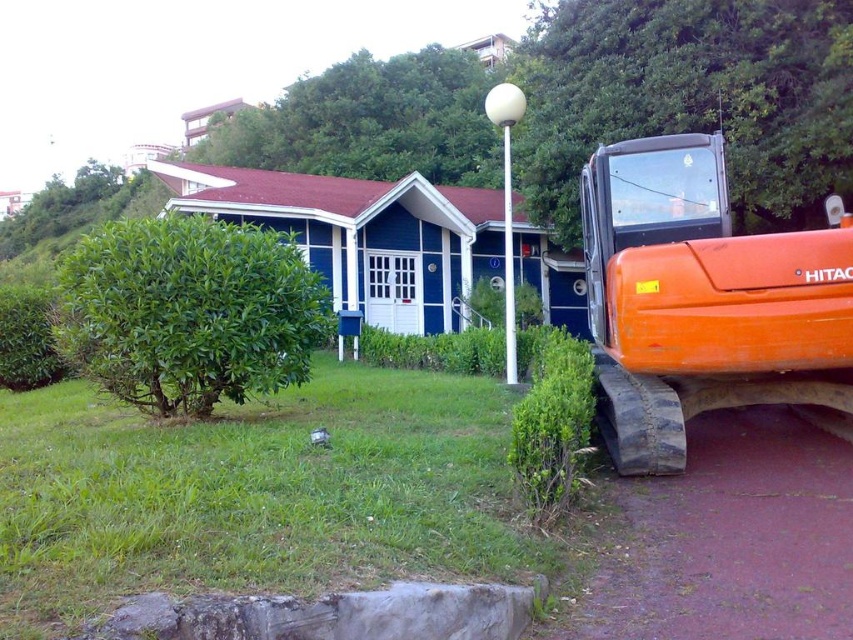
Does green grass at lower left appear under orange rubber tractor at right?

Indeed, green grass at lower left is positioned under orange rubber tractor at right.

Which is behind, point (32, 444) or point (677, 321)?

The point (677, 321) is more distant.

Find the location of a particular element. Image resolution: width=853 pixels, height=640 pixels. green grass at lower left is located at coordinates (254, 493).